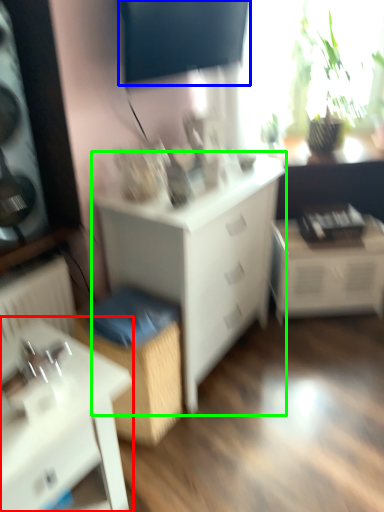
Question: Based on their relative distances, which object is farther from table (highlighted by a red box)? Choose from window screen (highlighted by a blue box) and chest of drawers (highlighted by a green box).

Choices:
 (A) window screen
 (B) chest of drawers

Answer: (A)